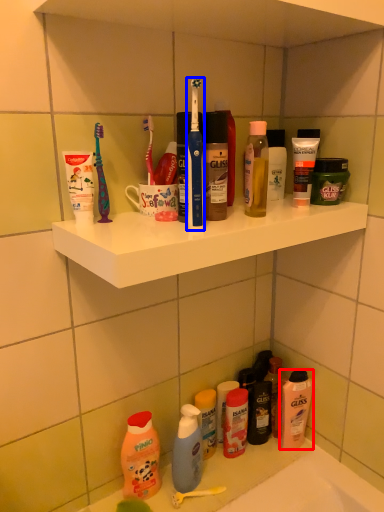
Question: Which object appears closest to the camera in this image, cleaning product (highlighted by a red box) or toothbrush (highlighted by a blue box)?

Choices:
 (A) cleaning product
 (B) toothbrush

Answer: (B)